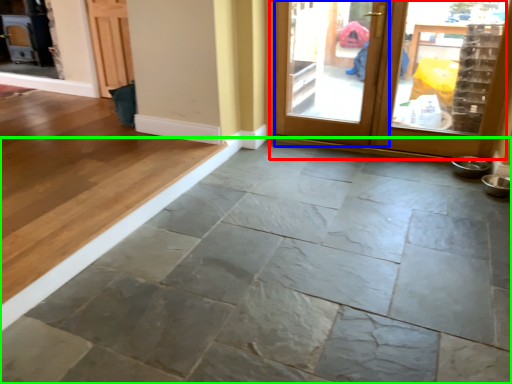
Question: Which object is positioned closest to door (highlighted by a red box)? Select from screen door (highlighted by a blue box) and concrete (highlighted by a green box).

Choices:
 (A) screen door
 (B) concrete

Answer: (A)